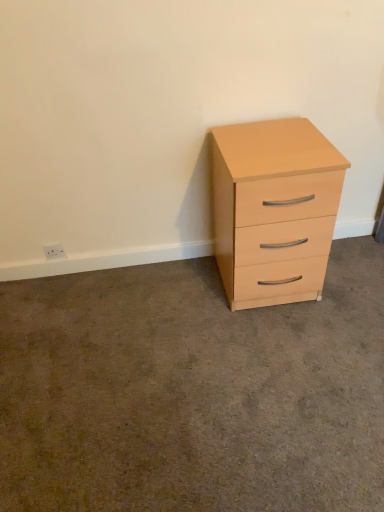
The width and height of the screenshot is (384, 512). Identify the location of vacant point above matte wood chest of drawers at right (from a real-world perspective). (274, 136).